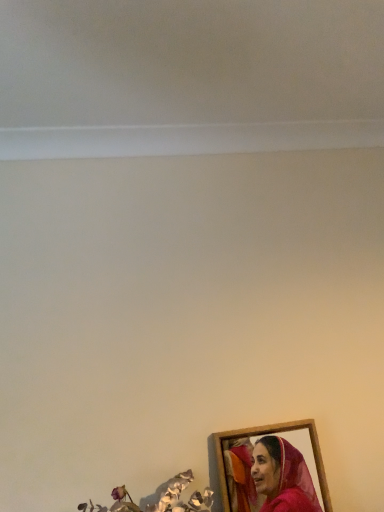
Image resolution: width=384 pixels, height=512 pixels. Describe the element at coordinates (270, 469) in the screenshot. I see `wooden frame at lower right` at that location.

You are a GUI agent. You are given a task and a screenshot of the screen. Output one action in this format:
    pyautogui.click(x=<x>, y=<y>)
    Task: Click on the wooden frame at lower right
    
    Given the screenshot: What is the action you would take?
    pyautogui.click(x=270, y=469)

Locate an element on the screen. The width and height of the screenshot is (384, 512). wooden frame at lower right is located at coordinates (270, 469).